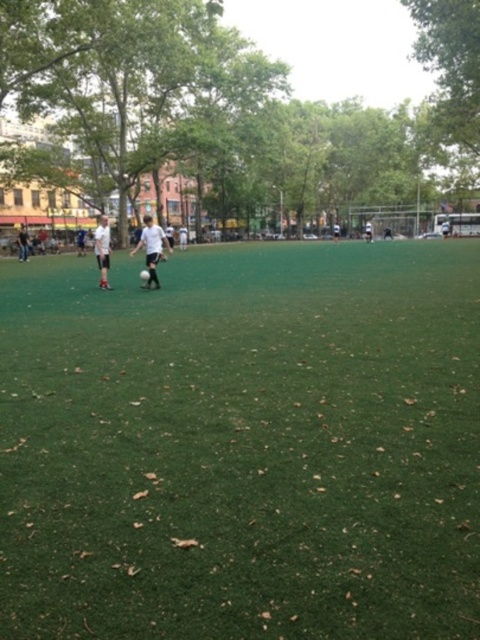
You are a soccer player standing at the point with coordinates [152,248]. You want to kick the ball to the goal located at the opposite end of the field. However, there is a tree line blocking the direct path. Can you kick the ball around the tree line to reach the goal?

The white matte soccer ball at center is located at point [152,248]. Since the tree line is in the background and the ball is at the center, you can kick the ball around the tree line to reach the goal by moving it to either the left or right side of the field, bypassing the obstruction.

You are a soccer player standing on the green artificial turf at center and want to kick the white matte soccer ball at center towards the goal. Which direction should you move to reach the ball first?

The green artificial turf at center is positioned on the right side of the white matte soccer ball at center, so you should move to your left to reach the ball first.